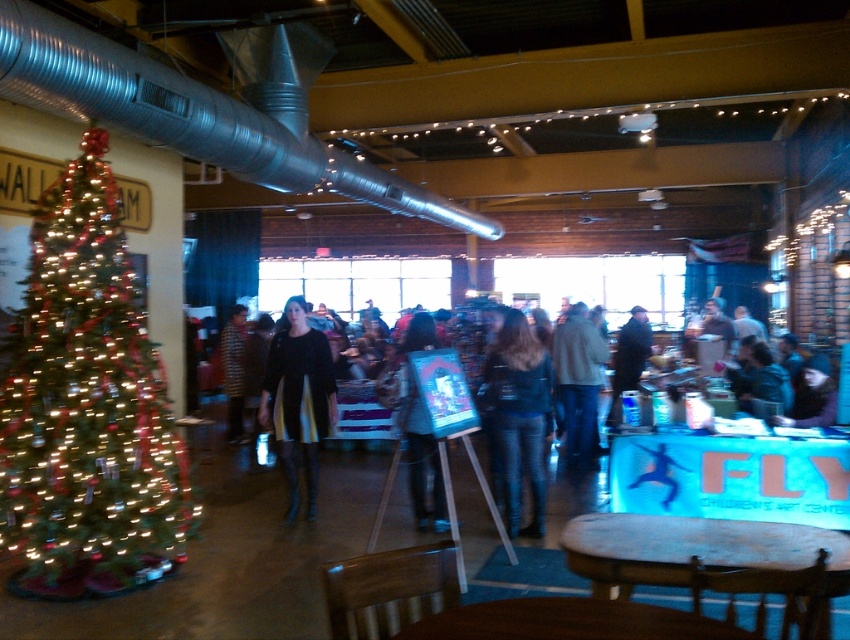
Question: Estimate the real-world distances between objects in this image. Which object is closer to the black leather jacket at center?

Choices:
 (A) dark blue jacket at center
 (B) denim jeans at center
 (C) striped fabric coat at center
 (D) brown wooden table at lower center

Answer: (B)

Question: Can you confirm if brown wooden table at lower center is smaller than matte black jacket at center?

Choices:
 (A) yes
 (B) no

Answer: (A)

Question: Considering the real-world distances, which object is closest to the striped fabric coat at center?

Choices:
 (A) black leather jacket at center
 (B) denim jeans at center
 (C) matte black jacket at center
 (D) brown wooden table at lower center

Answer: (C)

Question: Which of the following is the closest to the observer?

Choices:
 (A) matte black jacket at center
 (B) wooden table at center
 (C) shiny gold christmas tree at left

Answer: (B)

Question: Is black leather jacket at center further to camera compared to wooden table at center?

Choices:
 (A) yes
 (B) no

Answer: (A)

Question: Considering the relative positions of matte black jacket at center and striped fabric coat at center in the image provided, where is matte black jacket at center located with respect to striped fabric coat at center?

Choices:
 (A) right
 (B) left

Answer: (A)